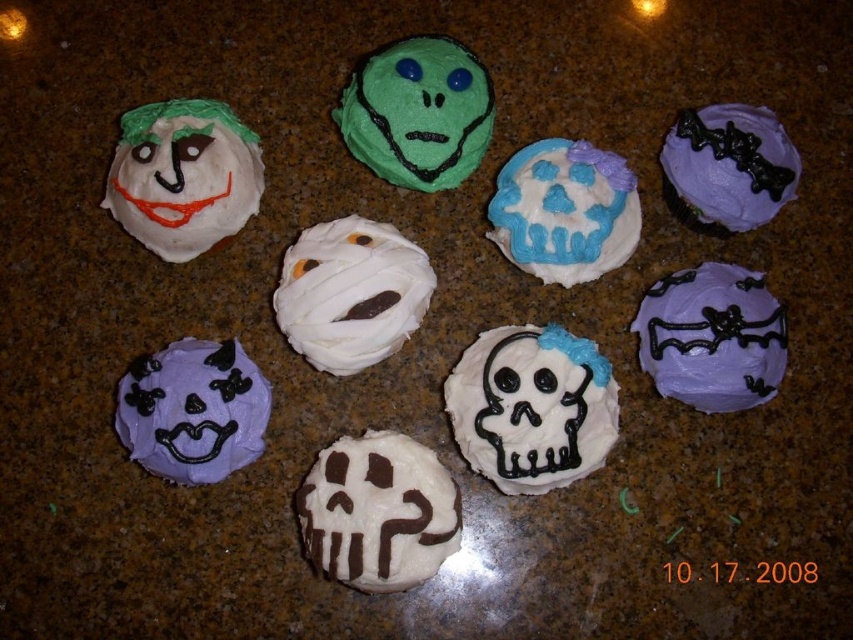
In the scene shown: You are a customer at a bakery and want to order the cupcake with the blue glossy skull at center. The bakery uses a coordinate system where the bottom left corner is the origin. Can you confirm if the point you selected, point (564,211), corresponds to the cupcake with the blue glossy skull at center?

Yes, the blue glossy skull at center is represented by point (564,211), so the selected coordinates are correct.

You are a customer at a bakery and want to choose between the white matte skull at center and the matte white face at upper left. Based on their shapes, which one do you think is narrower?

The white matte skull at center is thinner than the matte white face at upper left, so the white matte skull at center is narrower.

You are a customer at a bakery and see the cupcakes. You want to choose the taller decoration between the white matte skull at center and the matte white face at upper left. Which one should you choose?

The white matte skull at center is much taller than the matte white face at upper left, so you should choose the white matte skull at center.